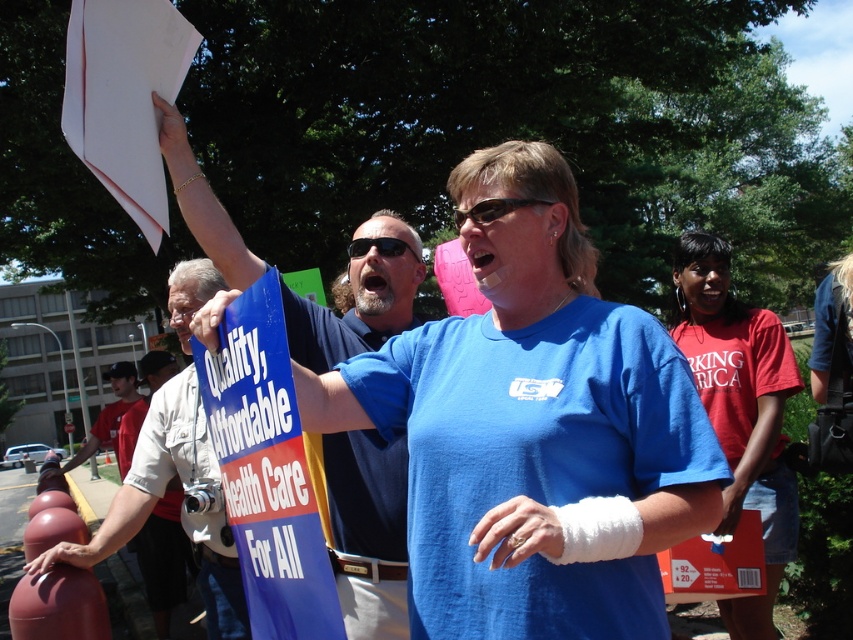
Is blue fabric shirt at center positioned before white cotton shirt at center?

Yes, blue fabric shirt at center is in front of white cotton shirt at center.

Does blue fabric shirt at center have a lesser width compared to white cotton shirt at center?

Yes, blue fabric shirt at center is thinner than white cotton shirt at center.

Is point (338, 451) positioned in front of point (142, 467)?

Yes, point (338, 451) is in front of point (142, 467).

I want to click on blue fabric shirt at center, so coord(364,525).

How much distance is there between blue fabric shirt at center and light beige cotton shirt at center?

2.53 meters

Between blue fabric shirt at center and light beige cotton shirt at center, which one is positioned lower?

light beige cotton shirt at center is below.

Is point (366, 637) farther from camera compared to point (136, 545)?

No, it is not.

Image resolution: width=853 pixels, height=640 pixels. What are the coordinates of `blue fabric shirt at center` in the screenshot? It's located at (364, 525).

Which is in front, point (155, 467) or point (136, 435)?

Point (155, 467)

Describe the element at coordinates (167, 493) in the screenshot. I see `white cotton shirt at center` at that location.

The height and width of the screenshot is (640, 853). I want to click on white cotton shirt at center, so click(x=167, y=493).